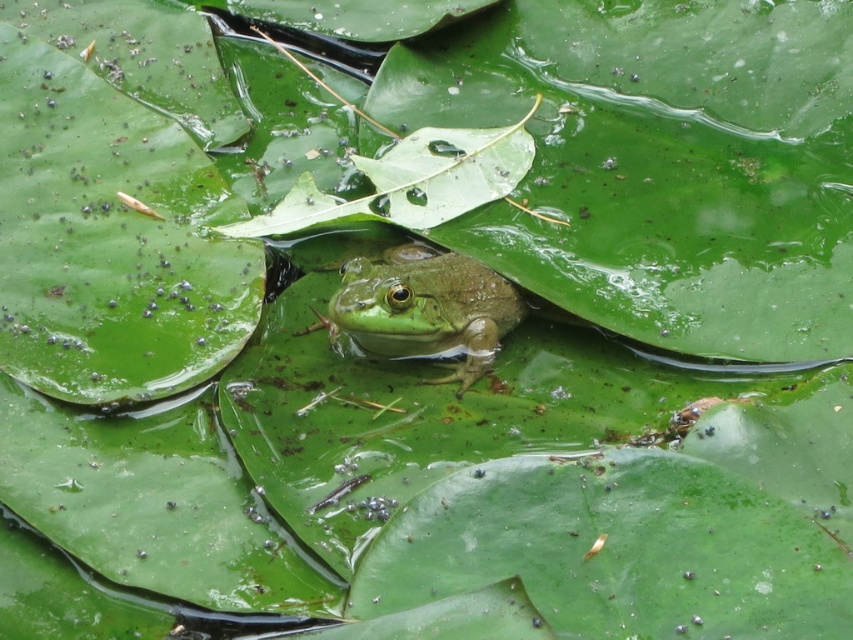
Question: Does green matte tree frog at center have a smaller size compared to green matte leaf at center?

Choices:
 (A) no
 (B) yes

Answer: (B)

Question: Among these points, which one is nearest to the camera?

Choices:
 (A) (392, 163)
 (B) (469, 332)

Answer: (B)

Question: Is green matte tree frog at center bigger than green matte leaf at center?

Choices:
 (A) no
 (B) yes

Answer: (A)

Question: Can you confirm if green matte tree frog at center is thinner than green matte leaf at center?

Choices:
 (A) no
 (B) yes

Answer: (B)

Question: Which point appears farthest from the camera in this image?

Choices:
 (A) (480, 316)
 (B) (326, 218)

Answer: (B)

Question: Which point is closer to the camera?

Choices:
 (A) (357, 200)
 (B) (489, 321)

Answer: (B)